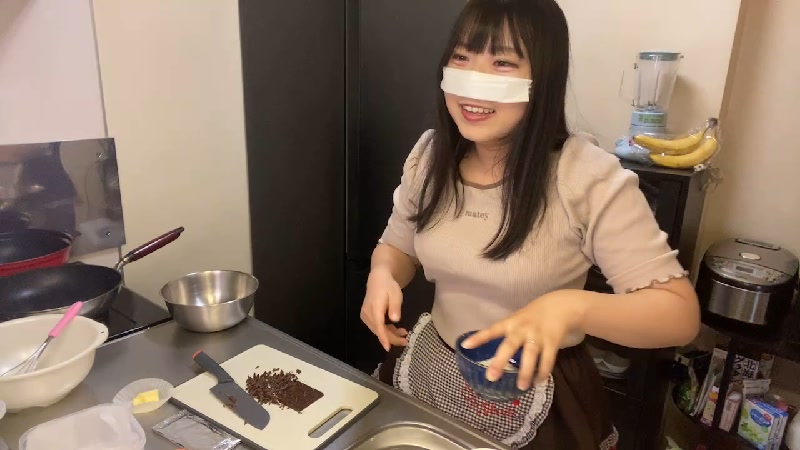
Locate an element on the screen. The height and width of the screenshot is (450, 800). black pantry door is located at coordinates (350, 122).